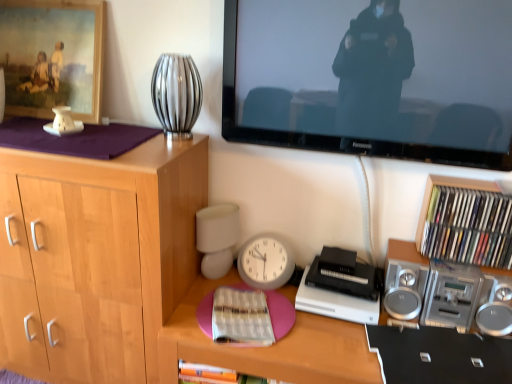
At what (x,y) coordinates should I click in order to perform the action: click on vacant space in front of silver metallic vase at upper center. Please return your answer as a coordinate pair (x, y). This screenshot has width=512, height=384. Looking at the image, I should click on (158, 147).